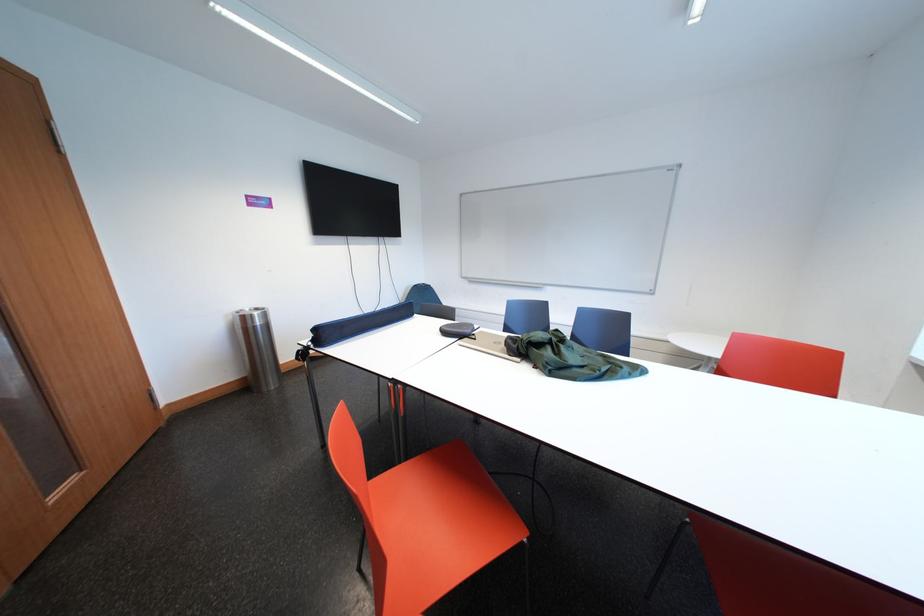
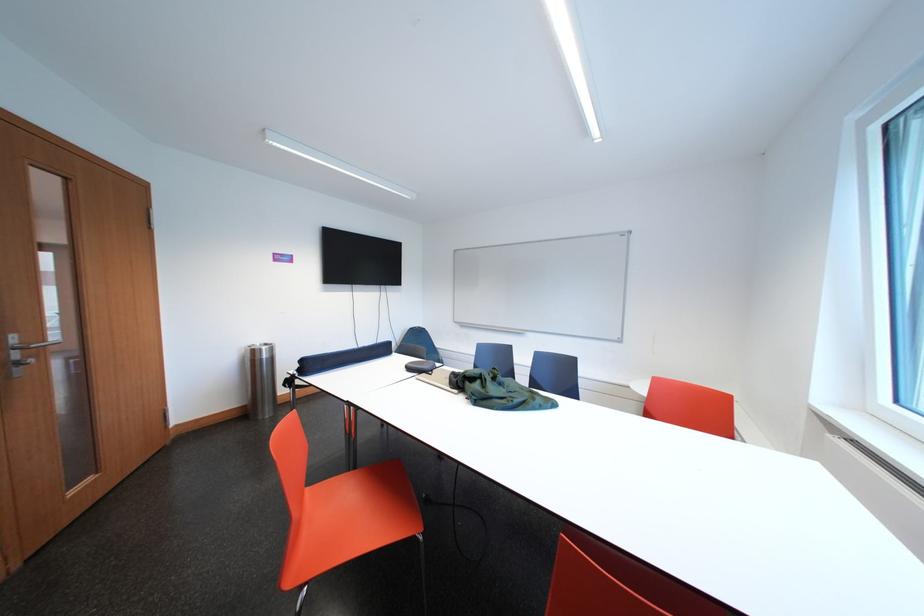
From the picture: The images are taken continuously from a first-person perspective. In which direction are you moving?

The movement direction of the cameraman is right, backward.